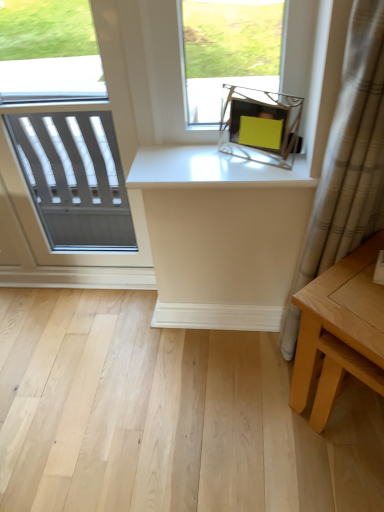
What is the approximate width of beige textured curtain at right?

6.83 inches.

In order to click on white glossy counter top at upper center in this screenshot , I will do `click(212, 169)`.

What do you see at coordinates (340, 331) in the screenshot? The width and height of the screenshot is (384, 512). I see `light brown wooden table at lower right` at bounding box center [340, 331].

The height and width of the screenshot is (512, 384). Describe the element at coordinates (29, 192) in the screenshot. I see `white textured window at left` at that location.

I want to click on beige textured curtain at right, so click(x=351, y=152).

Is light brown wooden table at lower right in front of or behind white glossy counter top at upper center in the image?

light brown wooden table at lower right is positioned closer to the viewer than white glossy counter top at upper center.

Consider the image. From the image's perspective, is light brown wooden table at lower right above white glossy counter top at upper center?

No.

Is light brown wooden table at lower right to the left or to the right of white glossy counter top at upper center in the image?

In the image, light brown wooden table at lower right appears on the right side of white glossy counter top at upper center.

Which is correct: light brown wooden table at lower right is inside white glossy counter top at upper center, or outside of it?

light brown wooden table at lower right exists outside the volume of white glossy counter top at upper center.

From a real-world perspective, is white glossy counter top at upper center positioned under white textured window at left based on gravity?

No, from a real-world perspective, white glossy counter top at upper center is not beneath white textured window at left.

Does white glossy counter top at upper center have a smaller size compared to white textured window at left?

Correct, white glossy counter top at upper center occupies less space than white textured window at left.

Between white glossy counter top at upper center and white textured window at left, which one appears on the left side from the viewer's perspective?

Positioned to the left is white textured window at left.

Does white glossy counter top at upper center have a lesser width compared to white textured window at left?

Incorrect, the width of white glossy counter top at upper center is not less than that of white textured window at left.

Does beige textured curtain at right appear on the right side of light brown wooden table at lower right?

No.

Is beige textured curtain at right not inside light brown wooden table at lower right?

Yes, beige textured curtain at right is outside of light brown wooden table at lower right.

Between beige textured curtain at right and light brown wooden table at lower right, which one has less height?

With less height is light brown wooden table at lower right.

Is beige textured curtain at right oriented towards light brown wooden table at lower right?

Yes, beige textured curtain at right faces towards light brown wooden table at lower right.

Find the location of `window above the beige textured curtain at right (from a real-world perspective)`. window above the beige textured curtain at right (from a real-world perspective) is located at coordinates (29, 192).

In terms of size, does beige textured curtain at right appear bigger or smaller than white textured window at left?

Clearly, beige textured curtain at right is smaller in size than white textured window at left.

Is beige textured curtain at right oriented towards white textured window at left?

No, beige textured curtain at right is not oriented towards white textured window at left.

Does beige textured curtain at right touch white textured window at left?

They are not placed beside each other.

Based on the photo, from a real-world perspective, between light brown wooden table at lower right and beige textured curtain at right, who is vertically lower?

In real-world perspective, light brown wooden table at lower right is lower.

Who is smaller, light brown wooden table at lower right or beige textured curtain at right?

Smaller between the two is beige textured curtain at right.

Would you say light brown wooden table at lower right is a long distance from beige textured curtain at right?

light brown wooden table at lower right is near beige textured curtain at right, not far away.

Consider the image. Does light brown wooden table at lower right appear on the right side of beige textured curtain at right?

Yes.

Is white glossy counter top at upper center thinner than beige textured curtain at right?

No, white glossy counter top at upper center is not thinner than beige textured curtain at right.

Is point (160, 162) less distant than point (376, 29)?

No, (160, 162) is behind (376, 29).

Consider the image. Who is shorter, white glossy counter top at upper center or beige textured curtain at right?

white glossy counter top at upper center is shorter.

Does white glossy counter top at upper center turn towards light brown wooden table at lower right?

No.

Locate an element on the screen. table below the white glossy counter top at upper center (from a real-world perspective) is located at coordinates (340, 331).

From the image's perspective, which is above, white glossy counter top at upper center or light brown wooden table at lower right?

white glossy counter top at upper center, from the image's perspective.

Does white glossy counter top at upper center lie in front of light brown wooden table at lower right?

No, white glossy counter top at upper center is behind light brown wooden table at lower right.

Find the location of a particular element. This screenshot has height=512, width=384. table that appears below the white glossy counter top at upper center (from a real-world perspective) is located at coordinates (340, 331).

Locate an element on the screen. window above the white glossy counter top at upper center (from the image's perspective) is located at coordinates (29, 192).

Considering their positions, is white glossy counter top at upper center positioned closer to beige textured curtain at right than white textured window at left?

white glossy counter top at upper center is positioned closer to the anchor beige textured curtain at right.

Based on their spatial positions, is white textured window at left or white glossy counter top at upper center further from beige textured curtain at right?

The object further to beige textured curtain at right is white textured window at left.

Looking at the image, which one is located closer to white glossy counter top at upper center, beige textured curtain at right or light brown wooden table at lower right?

beige textured curtain at right lies closer to white glossy counter top at upper center than the other object.

Looking at the image, which one is located further to light brown wooden table at lower right, white textured window at left or beige textured curtain at right?

white textured window at left.

Considering their positions, is light brown wooden table at lower right positioned closer to beige textured curtain at right than white glossy counter top at upper center?

light brown wooden table at lower right lies closer to beige textured curtain at right than the other object.

When comparing their distances from white glossy counter top at upper center, does white textured window at left or light brown wooden table at lower right seem further?

light brown wooden table at lower right is further to white glossy counter top at upper center.

Estimate the real-world distances between objects in this image. Which object is further from light brown wooden table at lower right, beige textured curtain at right or white textured window at left?

white textured window at left lies further to light brown wooden table at lower right than the other object.

Which object lies further to the anchor point white glossy counter top at upper center, white textured window at left or beige textured curtain at right?

The object further to white glossy counter top at upper center is white textured window at left.

This screenshot has width=384, height=512. In order to click on counter top between white textured window at left and light brown wooden table at lower right in this screenshot , I will do `click(212, 169)`.

You are a GUI agent. You are given a task and a screenshot of the screen. Output one action in this format:
    pyautogui.click(x=<x>, y=<y>)
    Task: Click on the curtain that lies between white glossy counter top at upper center and light brown wooden table at lower right from top to bottom
    Image resolution: width=384 pixels, height=512 pixels.
    Given the screenshot: What is the action you would take?
    pyautogui.click(x=351, y=152)

Image resolution: width=384 pixels, height=512 pixels. Identify the location of curtain situated between white textured window at left and light brown wooden table at lower right from left to right. (351, 152).

What are the coordinates of `counter top between white textured window at left and beige textured curtain at right in the horizontal direction` in the screenshot? It's located at (212, 169).